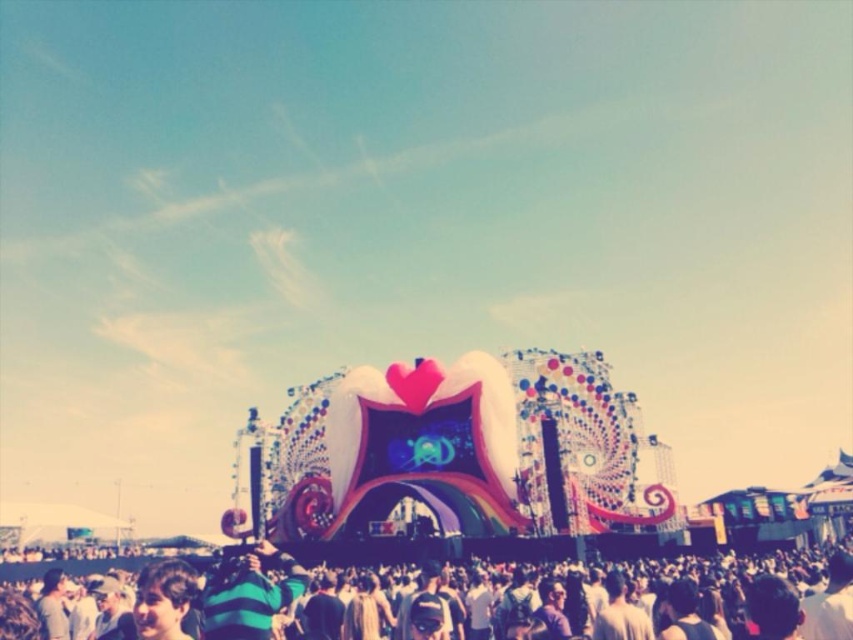
Question: Among these objects, which one is farthest from the camera?

Choices:
 (A) shiny metallic heart at center
 (B) dark gray fabric crowd at lower center

Answer: (A)

Question: Which of the following is the farthest from the observer?

Choices:
 (A) (822, 563)
 (B) (614, 426)

Answer: (B)

Question: Among these objects, which one is nearest to the camera?

Choices:
 (A) dark gray fabric crowd at lower center
 (B) shiny metallic heart at center

Answer: (A)

Question: Can you confirm if shiny metallic heart at center is bigger than dark gray fabric crowd at lower center?

Choices:
 (A) no
 (B) yes

Answer: (B)

Question: Is the position of shiny metallic heart at center more distant than that of dark gray fabric crowd at lower center?

Choices:
 (A) no
 (B) yes

Answer: (B)

Question: Considering the relative positions of shiny metallic heart at center and dark gray fabric crowd at lower center in the image provided, where is shiny metallic heart at center located with respect to dark gray fabric crowd at lower center?

Choices:
 (A) above
 (B) below

Answer: (A)